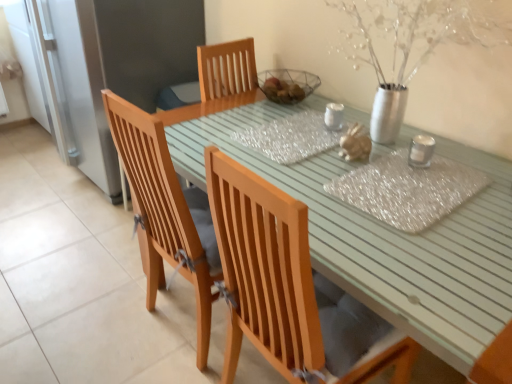
Identify the location of vacant area that is in front of translucent glass jar at center. pyautogui.click(x=342, y=175).